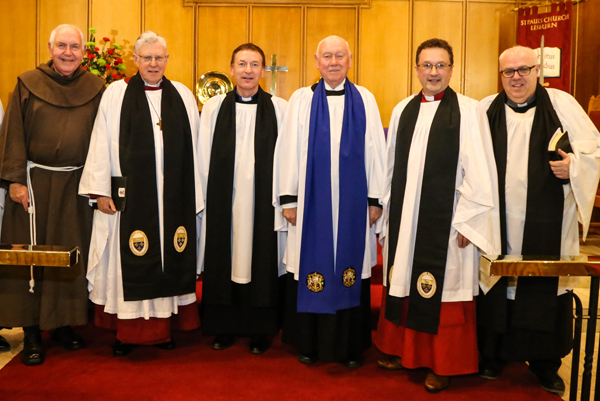
Where is `bible`? bible is located at coordinates (116, 185), (556, 140).